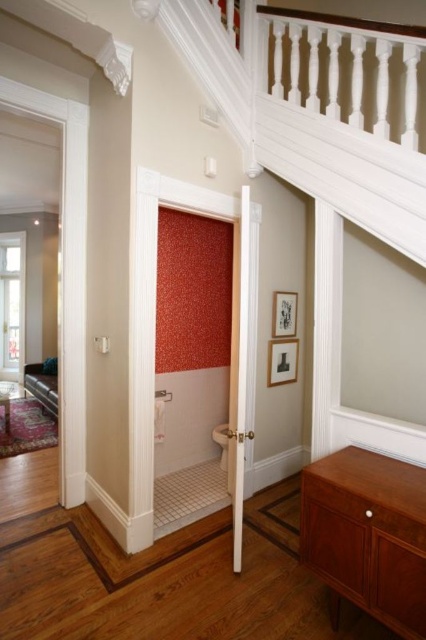
You are standing in the hallway looking towards the bathroom. There are two points marked in the scene, point A at coordinates point (258, 17) and point B at coordinates point (342, 484). Which point is closer to you?

Point A at coordinates point (258, 17) is further to the camera than point B at coordinates point (342, 484), so point B is closer to you.

You are standing in the hallway and see the point at coordinate (319, 108). What object is located at that point?

The point at coordinate (319, 108) indicates the white textured stair at upper center.